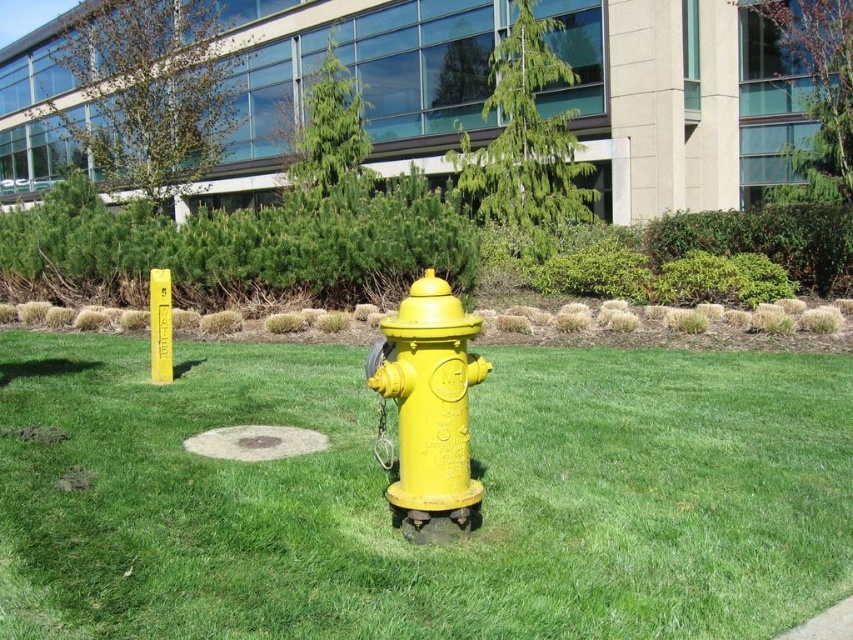
You are a delivery person trying to park your bike near the yellow matte fire hydrant at center. The city has a rule that you cannot park within 3 meters of a fire hydrant. If the gray concrete sidewalk at lower right is where you want to park, can you park there without violating the rule?

The yellow matte fire hydrant at center is located above the gray concrete sidewalk at lower right, which means the distance between them is likely less than 3 meters. Therefore, parking on the gray concrete sidewalk at lower right would violate the city rule.

You are a city planner reviewing a layout of a new park. The park has a yellow matte fire hydrant at center. According to the coordinates provided, where exactly is the hydrant positioned in the park layout?

The yellow matte fire hydrant at center is located at point (428, 410), which means it is positioned slightly off to the right side of the park layout.

Based on the photo, you are a gardener who needs to plant flowers in the green grass at center and the gray concrete sidewalk at lower right. Which area has more space available for planting?

The gray concrete sidewalk at lower right has more space available for planting because it is larger than the green grass at center.